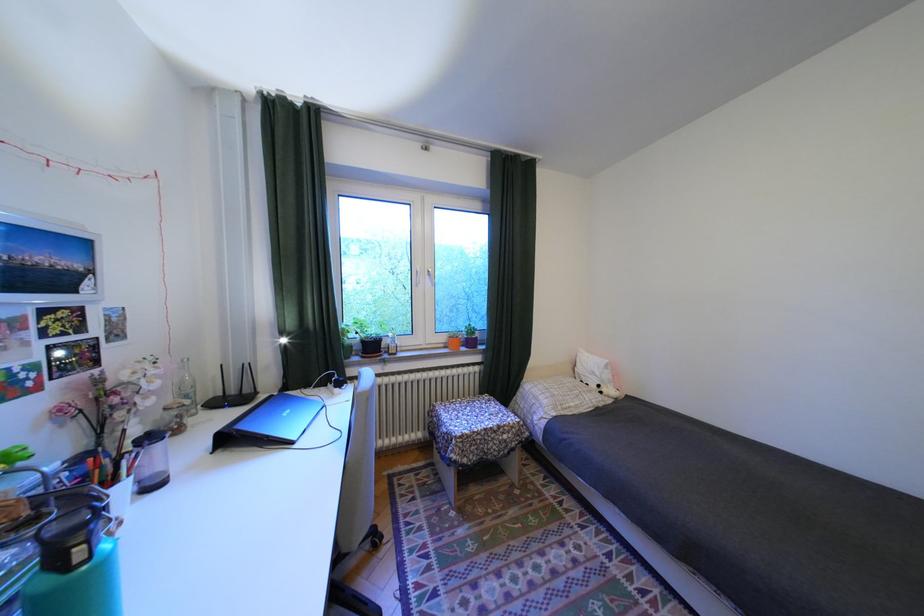
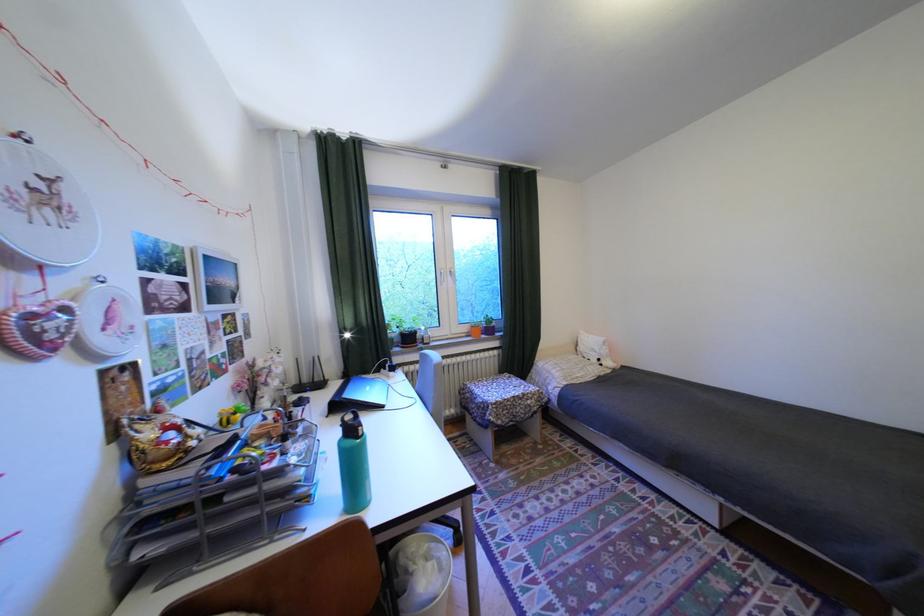
In the second image, find the point that corresponds to point 354,326 in the first image.

(397, 322)